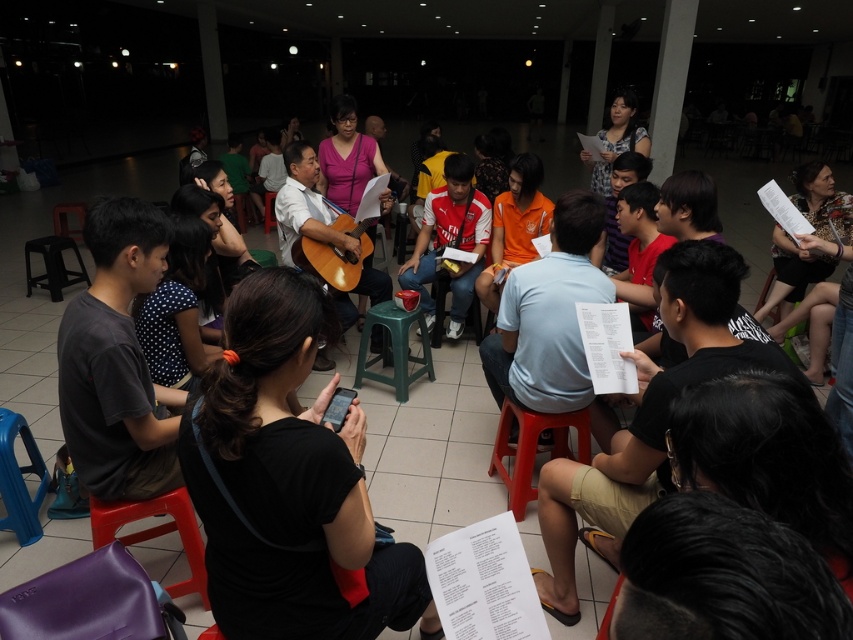
Is red plastic chair at lower center to the left of wooden acoustic guitar at center from the viewer's perspective?

In fact, red plastic chair at lower center is to the right of wooden acoustic guitar at center.

Which is below, red plastic chair at lower center or wooden acoustic guitar at center?

red plastic chair at lower center is below.

Locate an element on the screen. red plastic chair at lower center is located at coordinates (532, 449).

The height and width of the screenshot is (640, 853). Identify the location of red plastic chair at lower center. (532, 449).

Does purple leather bag at lower left have a lesser width compared to red plastic chair at lower center?

No.

Does point (80, 593) lie in front of point (527, 436)?

Yes, point (80, 593) is in front of point (527, 436).

Find the location of a particular element. The image size is (853, 640). purple leather bag at lower left is located at coordinates (91, 602).

Is purple leather bag at lower left shorter than purple plastic chair at lower left?

Yes.

Measure the distance between purple leather bag at lower left and camera.

purple leather bag at lower left is 1.44 meters away from camera.

In order to click on purple leather bag at lower left in this screenshot , I will do `click(91, 602)`.